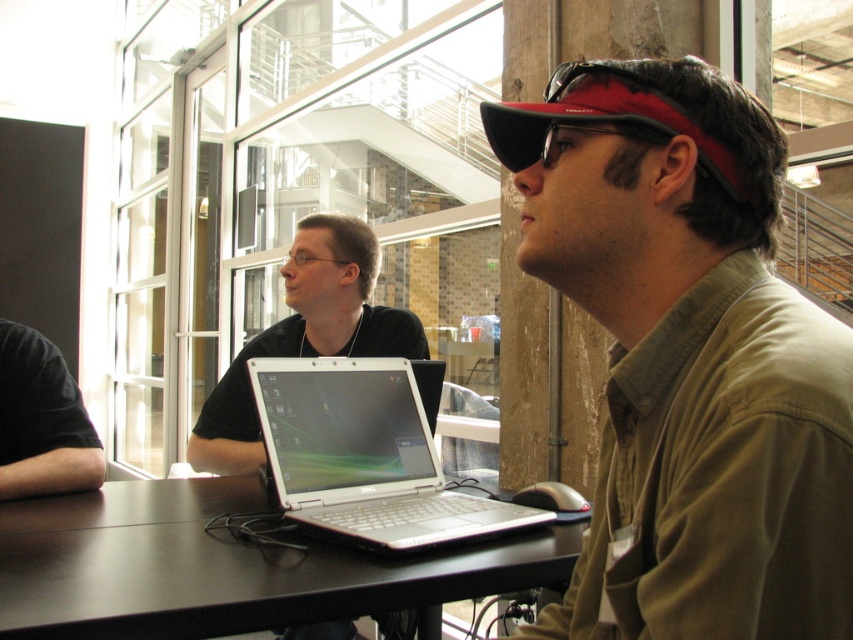
Question: Which object is closer to the camera taking this photo?

Choices:
 (A) silver metallic laptop at center
 (B) white glossy laptop at center

Answer: (A)

Question: Which object is the closest to the black matte shirt at left?

Choices:
 (A) silver metallic laptop at center
 (B) dark brown wooden table at center

Answer: (B)

Question: Considering the relative positions of silver metallic laptop at center and black matte baseball cap at upper right in the image provided, where is silver metallic laptop at center located with respect to black matte baseball cap at upper right?

Choices:
 (A) above
 (B) below

Answer: (B)

Question: Can you confirm if silver metallic laptop at center is smaller than white glossy laptop at center?

Choices:
 (A) no
 (B) yes

Answer: (B)

Question: Which point is closer to the camera?

Choices:
 (A) black matte shirt at left
 (B) black matte baseball cap at upper right
 (C) dark brown wooden table at center

Answer: (B)

Question: Can you confirm if dark brown wooden table at center is positioned to the right of black matte shirt at left?

Choices:
 (A) yes
 (B) no

Answer: (A)